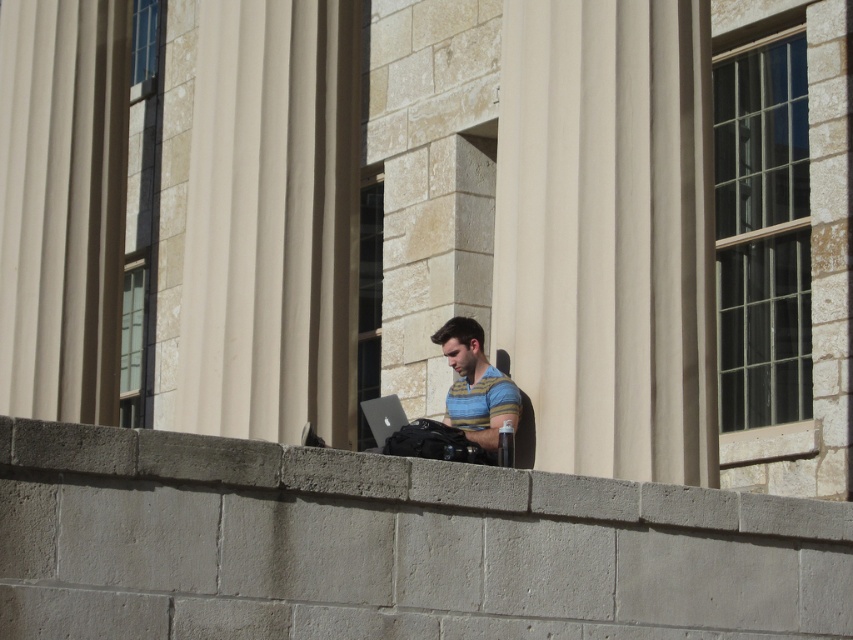
Question: Among these objects, which one is nearest to the camera?

Choices:
 (A) concrete ledge at center
 (B) smooth stone pillar at center
 (C) striped cotton shirt at center

Answer: (A)

Question: Which point is closer to the camera taking this photo?

Choices:
 (A) (605, 102)
 (B) (698, 502)
 (C) (459, 323)

Answer: (B)

Question: Is concrete ledge at center above striped cotton shirt at center?

Choices:
 (A) yes
 (B) no

Answer: (B)

Question: Can you confirm if smooth stone pillar at center is bigger than concrete ledge at center?

Choices:
 (A) yes
 (B) no

Answer: (A)

Question: Which of these objects is positioned closest to the concrete ledge at center?

Choices:
 (A) striped cotton shirt at center
 (B) smooth stone pillar at center

Answer: (B)

Question: Does smooth stone pillar at center have a smaller size compared to concrete ledge at center?

Choices:
 (A) no
 (B) yes

Answer: (A)